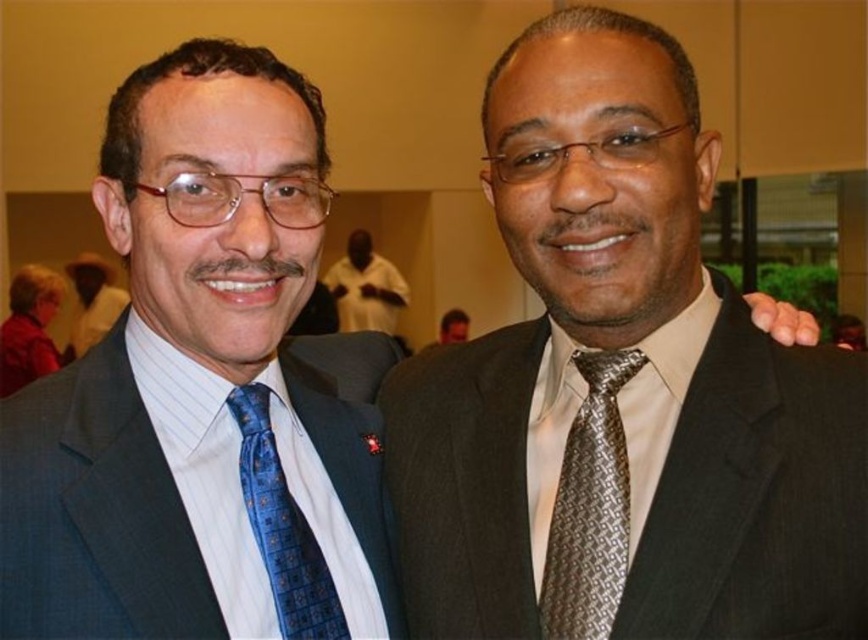
Question: Which of these objects is positioned closest to the blue satin tie at left?

Choices:
 (A) silver/grey textured tie at right
 (B) blue textured tie at left
 (C) blue dotted fabric tie at left

Answer: (B)

Question: Which object appears closest to the camera in this image?

Choices:
 (A) matte black suit at center
 (B) white matte shirt at center
 (C) blue satin tie at left

Answer: (A)

Question: Does white matte shirt at center appear over blue satin tie at left?

Choices:
 (A) no
 (B) yes

Answer: (B)

Question: Based on their relative distances, which object is farther from the blue textured tie at left?

Choices:
 (A) blue satin tie at left
 (B) blue dotted fabric tie at left

Answer: (A)

Question: Observing the image, what is the correct spatial positioning of silver/grey textured tie at right in reference to blue satin tie at left?

Choices:
 (A) right
 (B) left

Answer: (A)

Question: Does matte black suit at center have a larger size compared to blue dotted fabric tie at left?

Choices:
 (A) yes
 (B) no

Answer: (A)